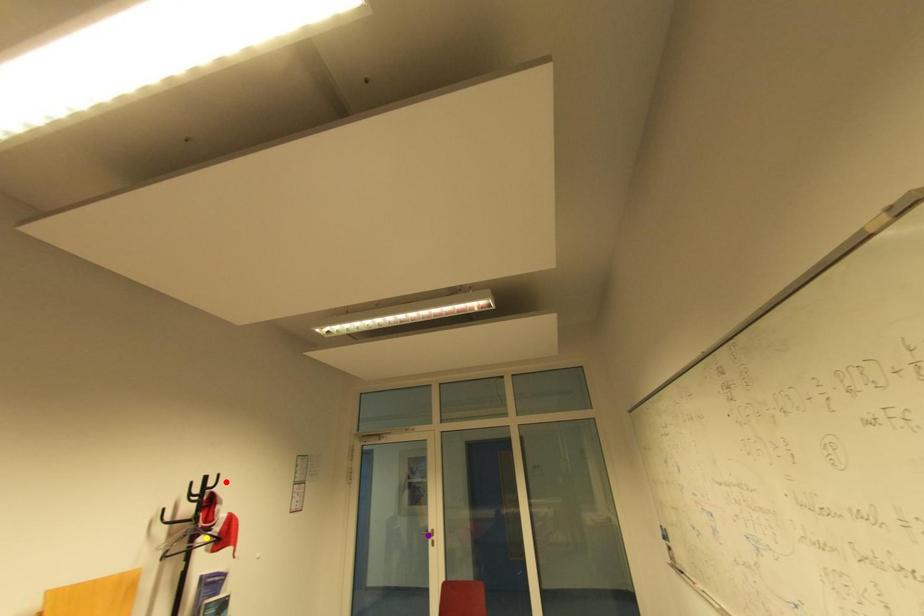
Order these from farthest to nearest:
yellow point, purple point, red point

purple point → red point → yellow point